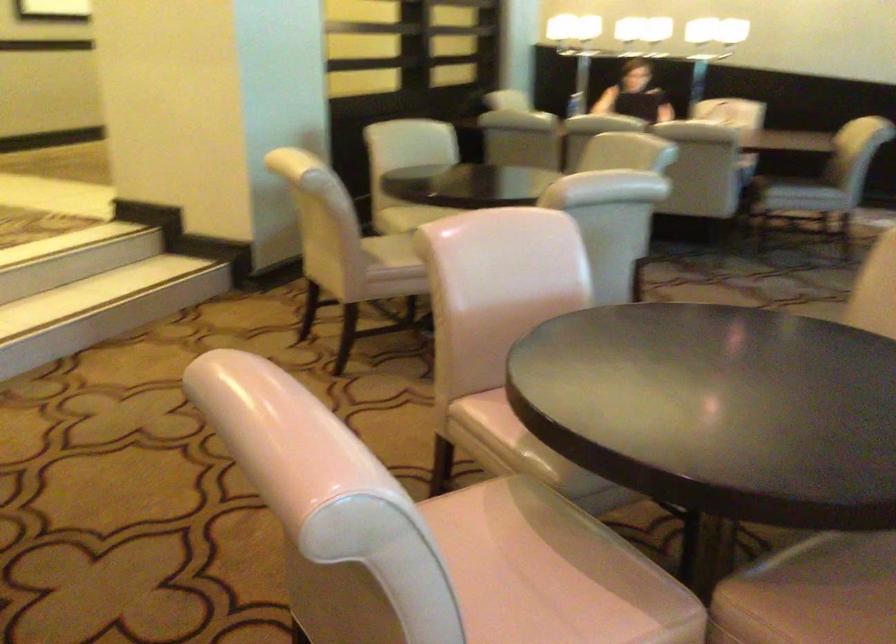
In order to click on beige chair sitting surface in this screenshot , I will do `click(391, 252)`.